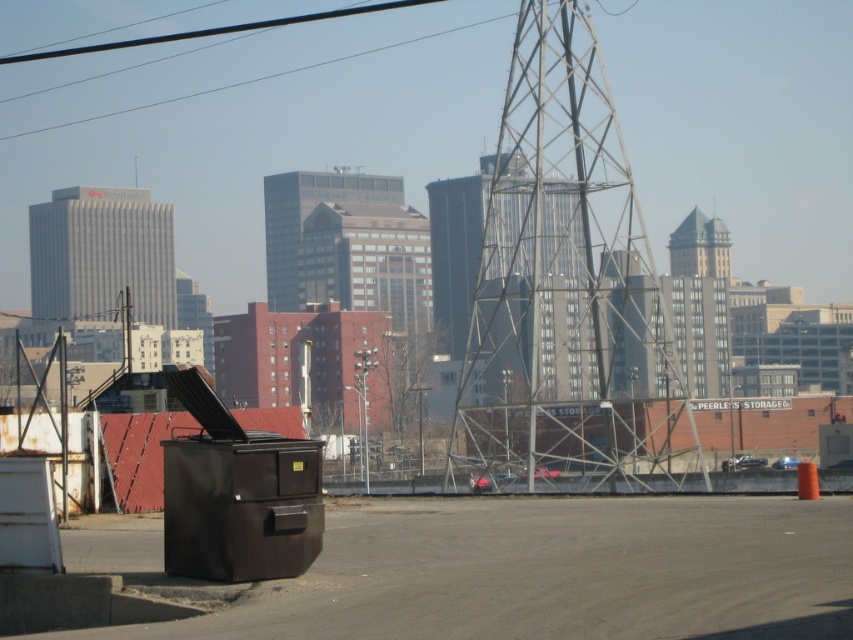
Question: Which point appears farthest from the camera in this image?

Choices:
 (A) (119, 234)
 (B) (415, 42)
 (C) (706, 253)

Answer: (B)

Question: Can you confirm if gray concrete skyscraper at center is bigger than black wire at upper center?

Choices:
 (A) no
 (B) yes

Answer: (B)

Question: Is gray concrete skyscraper at center above green glass tower at upper center?

Choices:
 (A) yes
 (B) no

Answer: (B)

Question: Which point is farther to the camera?

Choices:
 (A) green glass tower at upper center
 (B) gray concrete skyscraper at center
 (C) black wire at upper center

Answer: (C)

Question: Is gray concrete skyscraper at center wider than black wire at upper center?

Choices:
 (A) yes
 (B) no

Answer: (B)

Question: Which object appears closest to the camera in this image?

Choices:
 (A) gray concrete skyscraper at center
 (B) green glass tower at upper center
 (C) black wire at upper center

Answer: (A)